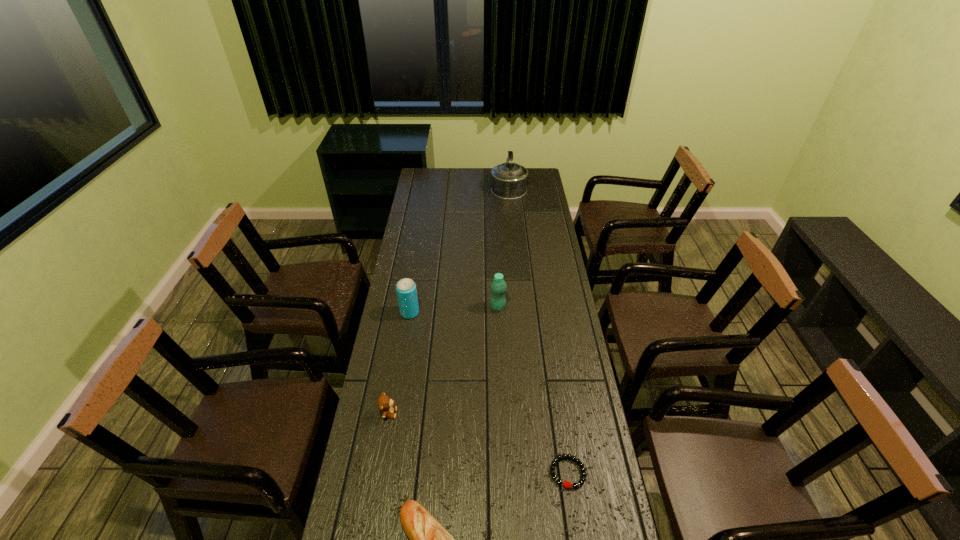
Find the location of a particular element. empty location between the soda can and the second nearest object is located at coordinates (489, 393).

You are a GUI agent. You are given a task and a screenshot of the screen. Output one action in this format:
    pyautogui.click(x=<x>, y=<y>)
    Task: Click on the vacant point located between the water bottle and the shortest object
    This screenshot has height=540, width=960.
    Given the screenshot: What is the action you would take?
    pyautogui.click(x=533, y=390)

At what (x,y) coordinates should I click in order to perform the action: click on the closest object to the kettle. Please return your answer as a coordinate pair (x, y). This screenshot has width=960, height=540. Looking at the image, I should click on (498, 286).

What are the coordinates of `object that is the second nearest to the tallest object` in the screenshot? It's located at (406, 290).

Where is `free region that satisfies the following two spatial constraints: 1. at the front cap of the water bottle; 2. on the left side of the second nearest object`? The width and height of the screenshot is (960, 540). free region that satisfies the following two spatial constraints: 1. at the front cap of the water bottle; 2. on the left side of the second nearest object is located at coordinates (505, 472).

At what (x,y) coordinates should I click in order to perform the action: click on vacant space that satisfies the following two spatial constraints: 1. on the face of the teddy bear; 2. on the back side of the bracelet. Please return your answer as a coordinate pair (x, y). Looking at the image, I should click on [378, 472].

Locate an element on the screen. free location that satisfies the following two spatial constraints: 1. at the front cap of the shortest object; 2. on the right side of the water bottle is located at coordinates coord(505,472).

Image resolution: width=960 pixels, height=540 pixels. Identify the location of blank area in the image that satisfies the following two spatial constraints: 1. on the back side of the shortest object; 2. at the front cap of the water bottle. (543, 307).